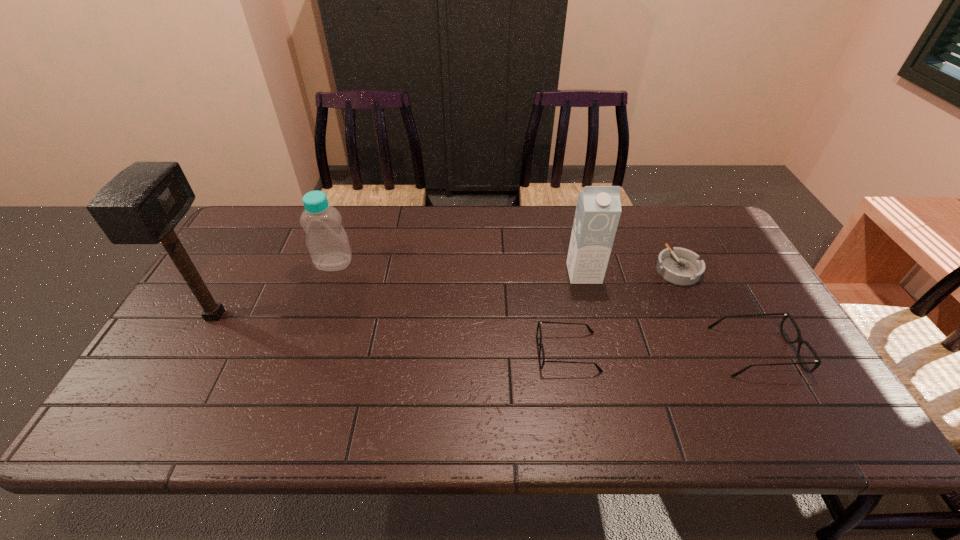
I want to click on free point between the shortest object and the third tallest object, so click(506, 266).

Locate an element on the screen. free spot between the leftmost object and the shorter spectacles is located at coordinates (392, 334).

At what (x,y) coordinates should I click in order to perform the action: click on vacant area that lies between the fourth tallest object and the ashtray. Please return your answer as a coordinate pair (x, y). This screenshot has width=960, height=540. Looking at the image, I should click on (716, 310).

Find the location of `free space between the carton and the fourth shortest object`. free space between the carton and the fourth shortest object is located at coordinates (459, 268).

You are a GUI agent. You are given a task and a screenshot of the screen. Output one action in this format:
    pyautogui.click(x=<x>, y=<y>)
    Task: Click on the vacant space that's between the mallet and the left spectacles
    This screenshot has height=540, width=960.
    Given the screenshot: What is the action you would take?
    pyautogui.click(x=392, y=334)

The height and width of the screenshot is (540, 960). I want to click on blank region between the second tallest object and the bottle, so pyautogui.click(x=459, y=268).

Image resolution: width=960 pixels, height=540 pixels. Identify the location of the fifth closest object relative to the shorter spectacles. (142, 204).

Where is `object that can be found as the second closest to the ashtray`? object that can be found as the second closest to the ashtray is located at coordinates (598, 209).

Image resolution: width=960 pixels, height=540 pixels. I want to click on free space that satisfies the following two spatial constraints: 1. on the back side of the leftmost object; 2. on the left side of the shortest object, so point(241,269).